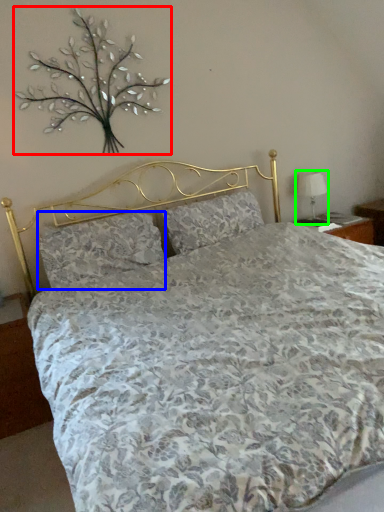
Question: Which is nearer to the floral arrangement (highlighted by a red box)? pillow (highlighted by a blue box) or table lamp (highlighted by a green box).

Choices:
 (A) pillow
 (B) table lamp

Answer: (A)